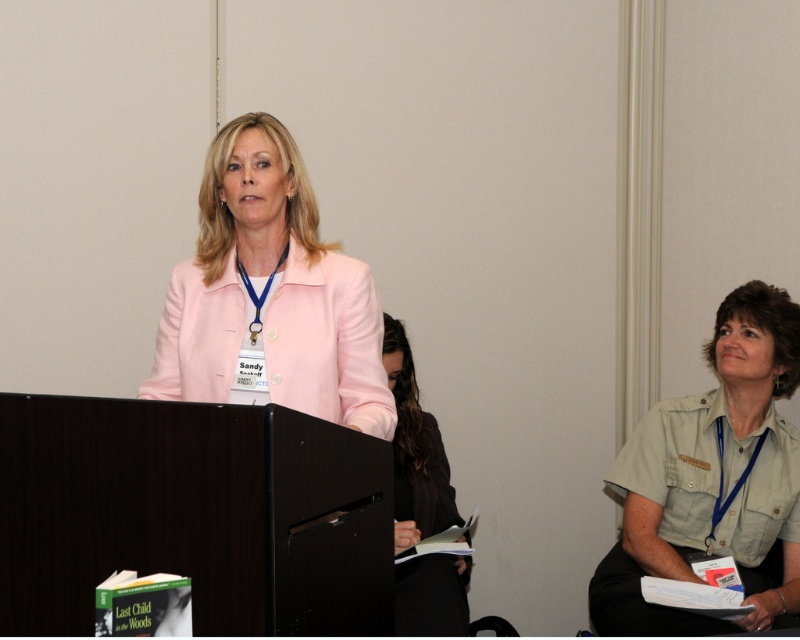
Question: Which of the following is the farthest from the observer?

Choices:
 (A) (237, 173)
 (B) (721, 548)
 (C) (416, 426)

Answer: (C)

Question: Can you confirm if pink fabric jacket at center is positioned to the right of black leather jacket at center?

Choices:
 (A) no
 (B) yes

Answer: (A)

Question: Is khaki uniform at right to the left of black leather jacket at center from the viewer's perspective?

Choices:
 (A) yes
 (B) no

Answer: (B)

Question: Among these points, which one is nearest to the camera?

Choices:
 (A) (244, 250)
 (B) (462, 596)

Answer: (A)

Question: Where is pink fabric jacket at center located in relation to khaki uniform at right in the image?

Choices:
 (A) above
 (B) below

Answer: (A)

Question: Which object is farther from the camera taking this photo?

Choices:
 (A) pink fabric jacket at center
 (B) khaki uniform at right

Answer: (B)